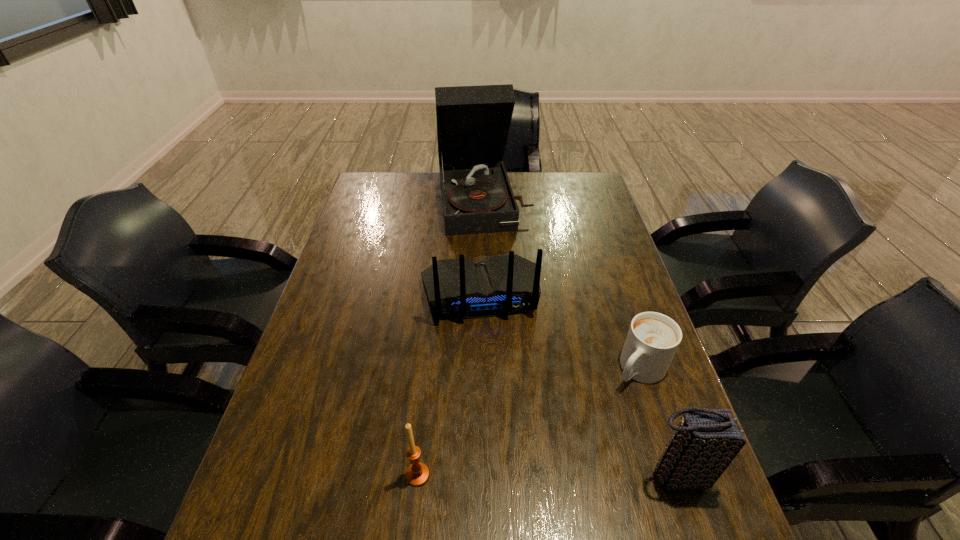
The height and width of the screenshot is (540, 960). What are the coordinates of `candle_holder` in the screenshot? It's located at (417, 475).

Where is `clutch bag`? The image size is (960, 540). clutch bag is located at coordinates (705, 442).

Find the location of a particular element. The height and width of the screenshot is (540, 960). the third nearest object is located at coordinates (653, 338).

Locate an element on the screen. Image resolution: width=960 pixels, height=540 pixels. cappuccino is located at coordinates [x=653, y=338].

This screenshot has height=540, width=960. I want to click on the fourth nearest object, so click(498, 285).

Identify the location of the tallest object. This screenshot has width=960, height=540. (473, 122).

Locate an element on the screen. This screenshot has height=540, width=960. the farthest object is located at coordinates (473, 122).

Where is `free location located 0.230m on the right of the candle_holder`? Image resolution: width=960 pixels, height=540 pixels. free location located 0.230m on the right of the candle_holder is located at coordinates (544, 475).

At what (x,y) coordinates should I click in order to perform the action: click on vacant space situated on the side with the handle of the cappuccino. Please return your answer as a coordinate pair (x, y). The height and width of the screenshot is (540, 960). Looking at the image, I should click on (606, 407).

Identify the location of vacant space located on the side with the handle of the cappuccino. Image resolution: width=960 pixels, height=540 pixels. (551, 469).